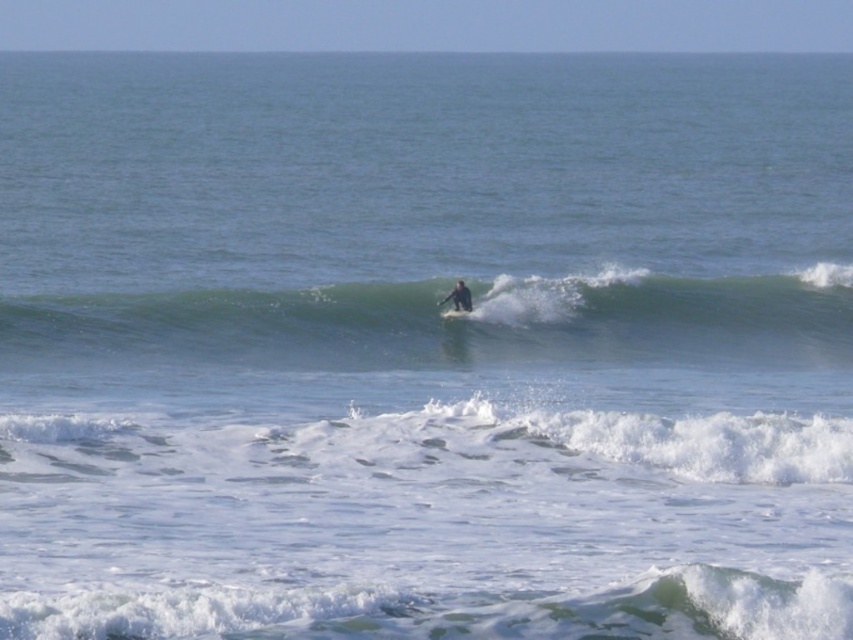
You are a lifeguard on duty and notice a surfer wearing a dark blue wetsuit at center and a white frothy wave at lower center approaching. Based on the distance between them, can you estimate if the surfer has enough time to avoid the wave if they start paddling immediately? Assume the surfer can paddle at 1.5 meters per second and the wave is moving towards them at 3 meters per second.

The distance between the white frothy wave at lower center and the dark blue wetsuit at center is 14.25 meters. The wave is moving towards the surfer at 3 mps, and the surfer can paddle away at 1.5 mps. The relative speed between them is 3 mps minus 1.5 mps equals 1.5 mps. The time until collision would be 14.25 meters divided by 1.5 mps equals 9.5 seconds. Whether the surfer can avoid the wave depends on their ability to maneuver in that time, but the calculation shows they have approximately 9.5 seconds.

You are a photographer trying to capture the surfer in the center. To get a clear shot of the dark blue wetsuit at center, should you adjust your focus to be closer or farther away from the white frothy wave at lower center?

The white frothy wave at lower center is closer to the viewer than the dark blue wetsuit at center. To focus on the dark blue wetsuit at center, you need to adjust your focus farther away from the white frothy wave at lower center.

You are a photographer trying to capture the surfer on the green rubber surfboard at center. To ensure the surfboard is perfectly centered in your shot, where should you position your camera? Please provide the coordinates in the format of a point like this example format, e.g., point A is at point 0.5,0.5.

The green rubber surfboard at center is located at point (445, 323), so you should position your camera to aim directly at that coordinate to ensure the surfboard is perfectly centered in your shot.